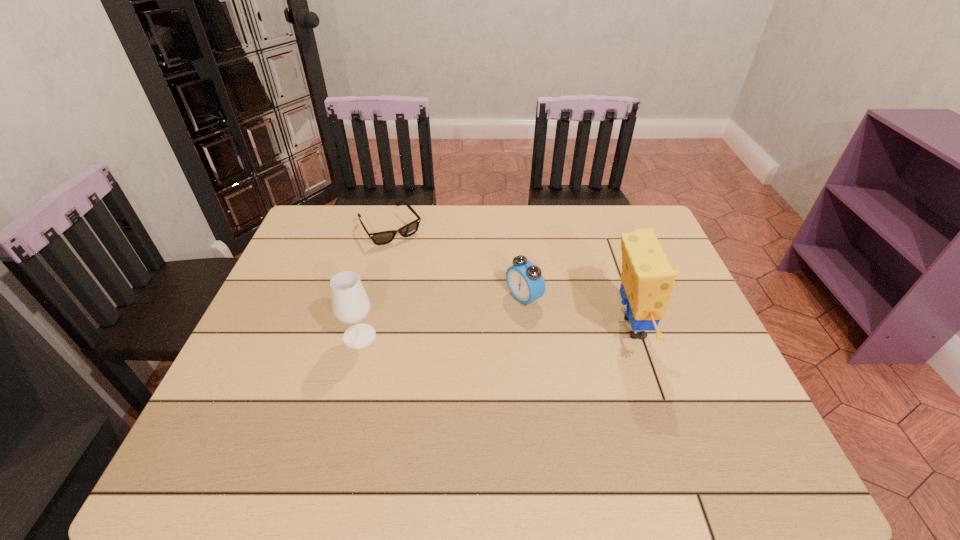
Where is `vacant space at the far right corner`? This screenshot has width=960, height=540. vacant space at the far right corner is located at coordinates (660, 233).

You are a GUI agent. You are given a task and a screenshot of the screen. Output one action in this format:
    pyautogui.click(x=<x>, y=<y>)
    Task: Click on the vacant region at the near right corner of the desktop
    
    Given the screenshot: What is the action you would take?
    pyautogui.click(x=712, y=396)

Where is `blank region between the rightmost object and the glass`? blank region between the rightmost object and the glass is located at coordinates (496, 332).

You are a GUI agent. You are given a task and a screenshot of the screen. Output one action in this format:
    pyautogui.click(x=<x>, y=<y>)
    Task: Click on the free space between the farthest object and the glass
    The height and width of the screenshot is (540, 960).
    Given the screenshot: What is the action you would take?
    pyautogui.click(x=375, y=282)

Identify the location of unoccupied position between the third shortest object and the sunglasses. This screenshot has width=960, height=540. (375, 282).

The height and width of the screenshot is (540, 960). I want to click on vacant region between the glass and the farthest object, so click(375, 282).

Where is `empty location between the glass and the alarm clock`? The height and width of the screenshot is (540, 960). empty location between the glass and the alarm clock is located at coordinates [442, 316].

At what (x,y) coordinates should I click in order to perform the action: click on vacant area that lies between the sunglasses and the glass. Please return your answer as a coordinate pair (x, y). The height and width of the screenshot is (540, 960). Looking at the image, I should click on (375, 282).

Find the location of a particular element. The height and width of the screenshot is (540, 960). vacant space that is in between the sponge and the second object from right to left is located at coordinates (578, 313).

Locate an element on the screen. free space between the shortest object and the third object from left to right is located at coordinates (457, 263).